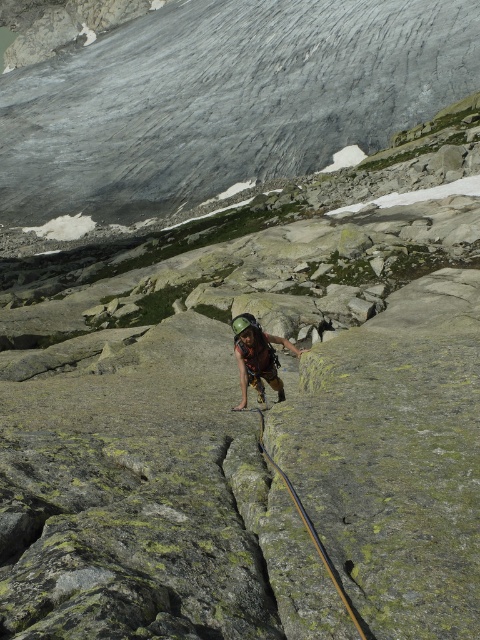
Question: From the image, what is the correct spatial relationship of gray rock at center in relation to black rubber rope at center?

Choices:
 (A) left
 (B) right

Answer: (A)

Question: Which point appears closest to the camera in this image?

Choices:
 (A) (256, 385)
 (B) (262, 83)

Answer: (A)

Question: Based on their relative distances, which object is farther from the matte brown helmet at center?

Choices:
 (A) gray rock at center
 (B) black rubber rope at center

Answer: (A)

Question: Is gray rock at center wider than black rubber rope at center?

Choices:
 (A) yes
 (B) no

Answer: (A)

Question: Which object is the closest to the black rubber rope at center?

Choices:
 (A) matte brown helmet at center
 (B) gray rock at center

Answer: (A)

Question: Observing the image, what is the correct spatial positioning of matte brown helmet at center in reference to black rubber rope at center?

Choices:
 (A) above
 (B) below

Answer: (A)